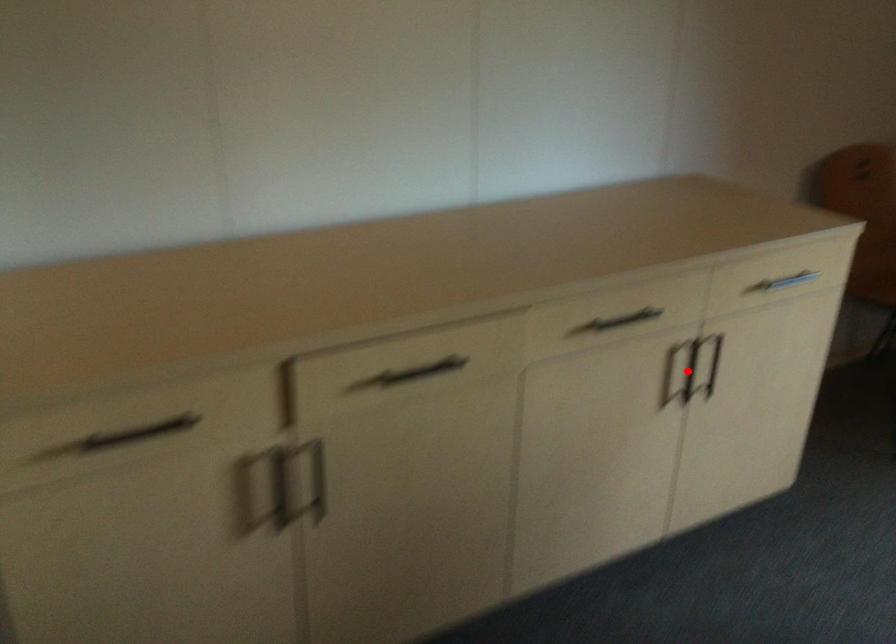
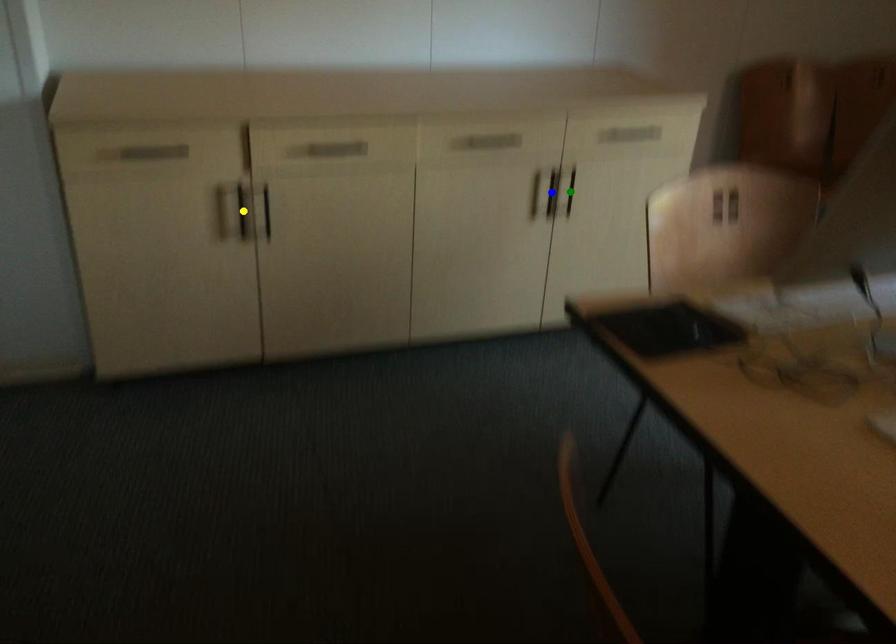
Question: I am providing you with two images of the same scene from different viewpoints. A red point is marked on the first image. You are given multiple points on the second image. Which spot in image 2 lines up with the point in image 1?

Choices:
 (A) blue point
 (B) yellow point
 (C) green point

Answer: (A)